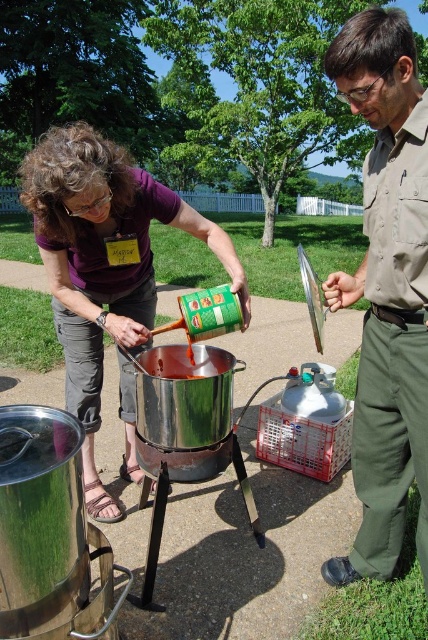
Based on the scene description, which person is wearing the brown uniform at center and is shorter than the matte purple shirt at center?

The person wearing the brown uniform at center is shorter than the matte purple shirt at center, which belongs to the person on the left.

You are a photographer standing at the back of the scene. You want to take a photo that includes both the brown uniform at center and the matte purple shirt at center. What is the minimum distance you should position yourself from the closest object to ensure both are in frame?

The minimum distance you should position yourself from the closest object is 35.05 inches to ensure both the brown uniform at center and the matte purple shirt at center are in frame since they are 35.05 inches apart.

You are standing at the camera position and want to pick up an object. Which of the two points, point (371, 189) or point (97, 285), is closer to you?

Point (371, 189) is closer to the camera than point (97, 285).